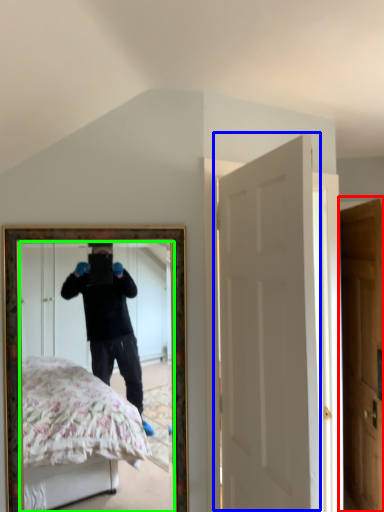
Question: Which object is positioned farthest from door (highlighted by a red box)? Select from door (highlighted by a blue box) and mirror (highlighted by a green box).

Choices:
 (A) door
 (B) mirror

Answer: (B)